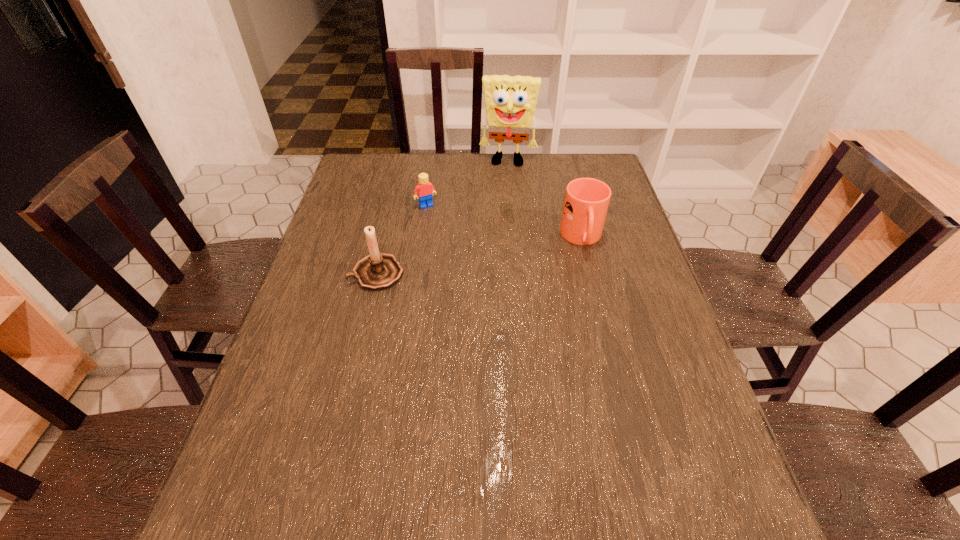
Find the location of a particular element. Image resolution: width=960 pixels, height=540 pixels. vacant spot on the desktop that is between the candle holder and the mug and is positioned on the face of the third nearest object is located at coordinates (459, 259).

Identify the location of vacant spot on the desktop that is between the candle holder and the mug and is positioned on the face of the second object from right to left. (497, 253).